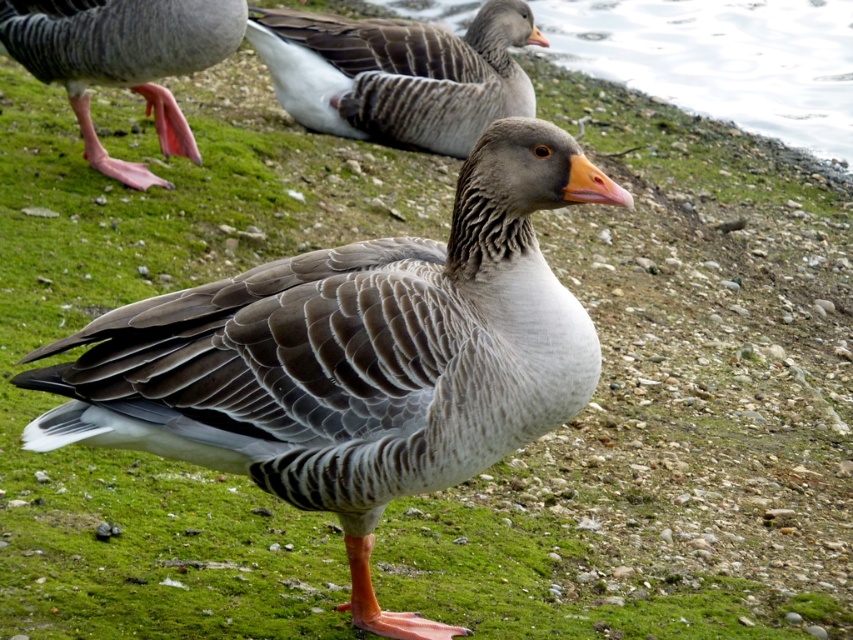
You are standing at the point labeled as point (372, 81) in the image. You want to take a photo of the goose in the scene. Can you estimate how far you are from the goose?

The point labeled as point (372, 81) is 16.59 feet away from the viewer, so you are 16.59 feet away from the goose.

You are a wildlife photographer trying to capture a close shot of the gray feathered goose at upper center. However, there is a gray matte duck at center blocking your view. Based on their sizes, which animal should you focus on first to ensure you can fit both in the frame?

The gray matte duck at center is bigger than the gray feathered goose at upper center, so you should focus on the gray matte duck at center first to ensure it fits in the frame, allowing space for the smaller goose.

You are a birdwatcher observing the scene. You see the gray matte duck at center and the gray feathered goose at upper center. Which of these two birds is positioned more to the right side of the scene?

The gray matte duck at center is positioned more to the right side of the scene because it is located to the right of the gray feathered goose at upper center.